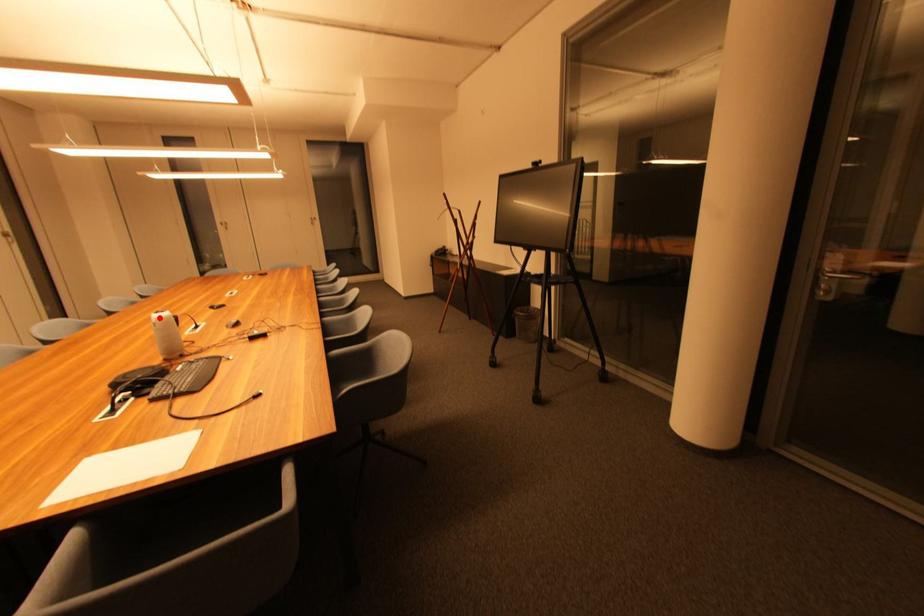
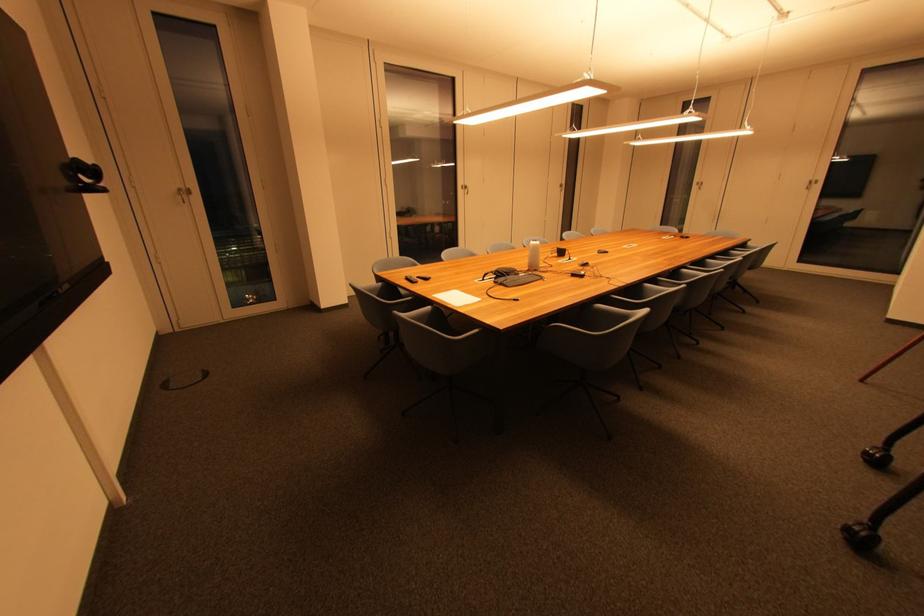
Find the pixel in the second image that matches the highlighted location in the first image.

(538, 244)